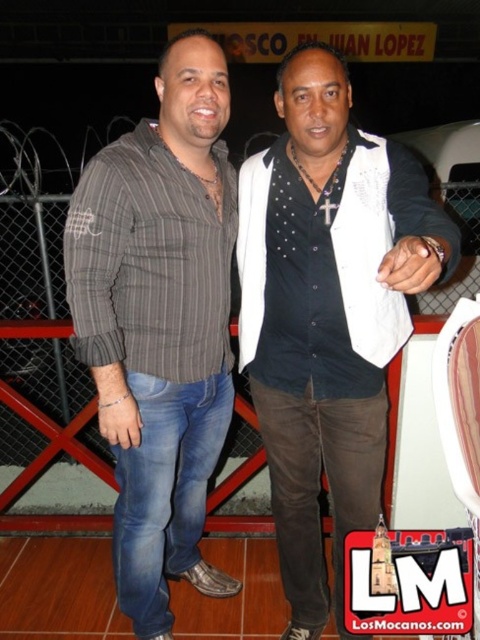
Question: Which object is closer to the camera taking this photo?

Choices:
 (A) white textured vest at center
 (B) gray striped shirt at center

Answer: (A)

Question: Can you confirm if white textured vest at center is smaller than gray striped shirt at center?

Choices:
 (A) no
 (B) yes

Answer: (A)

Question: Does white textured vest at center have a lesser width compared to gray striped shirt at center?

Choices:
 (A) yes
 (B) no

Answer: (B)

Question: Observing the image, what is the correct spatial positioning of white textured vest at center in reference to gray striped shirt at center?

Choices:
 (A) below
 (B) above

Answer: (A)

Question: Which point appears farthest from the camera in this image?

Choices:
 (A) (172, 554)
 (B) (368, 285)

Answer: (A)

Question: Which point appears closest to the camera in this image?

Choices:
 (A) (87, 250)
 (B) (362, 388)

Answer: (A)